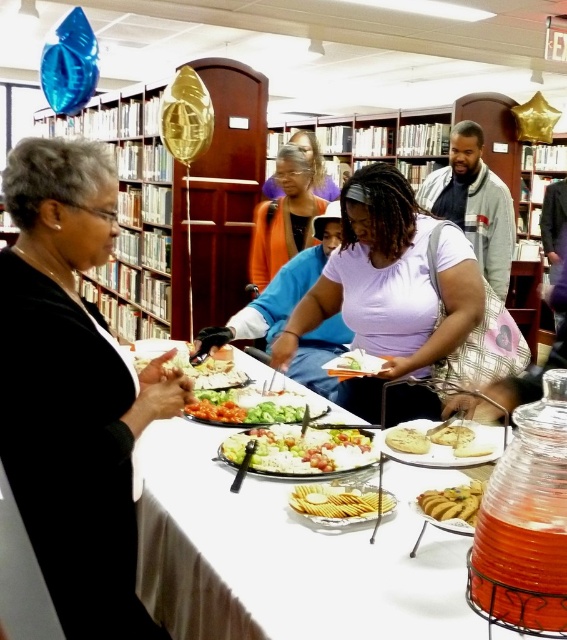
You are a guest at the event and want to grab a piece of the white crumbly cake at center. However, you notice the black matte sweater at left is in the way. Can you reach the cake without moving the sweater?

The black matte sweater at left is located above the white crumbly cake at center, so you can reach the cake without moving the sweater since it is below the sweater.

What is located at the coordinates point (73, 390)?

The black matte sweater at left is located at point (73, 390).

You are at a community event and want to grab a piece of bread from the table. You see the vibrant green salad at center and the white crumbly bread at center. Which item is closer to you if you are standing in front of the table?

The vibrant green salad at center is closer to you because the white crumbly bread at center is positioned behind it.